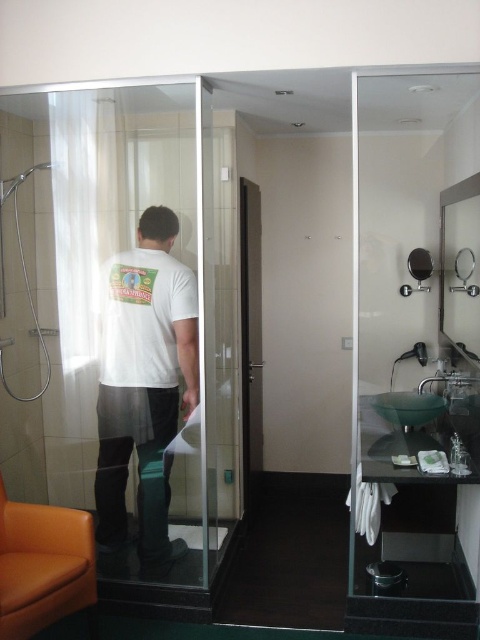
Question: Is transparent glass door at center positioned at the back of white matte t-shirt at center?

Choices:
 (A) no
 (B) yes

Answer: (A)

Question: Which object is closer to the camera taking this photo?

Choices:
 (A) transparent glass door at center
 (B) white matte t-shirt at center
 (C) matte black mirror at upper right

Answer: (A)

Question: Which point is closer to the camera?

Choices:
 (A) matte black mirror at upper right
 (B) transparent glass door at center

Answer: (B)

Question: In this image, where is white matte t-shirt at center located relative to matte black mirror at upper right?

Choices:
 (A) left
 (B) right

Answer: (A)

Question: Is transparent glass door at center wider than white matte t-shirt at center?

Choices:
 (A) no
 (B) yes

Answer: (B)

Question: Based on their relative distances, which object is farther from the matte black mirror at upper right?

Choices:
 (A) white matte t-shirt at center
 (B) transparent glass door at center

Answer: (A)